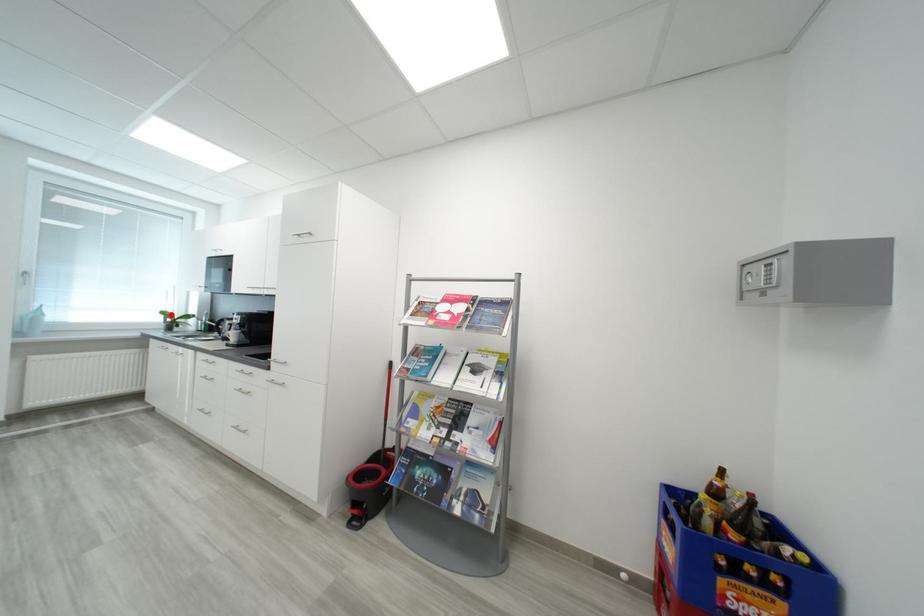
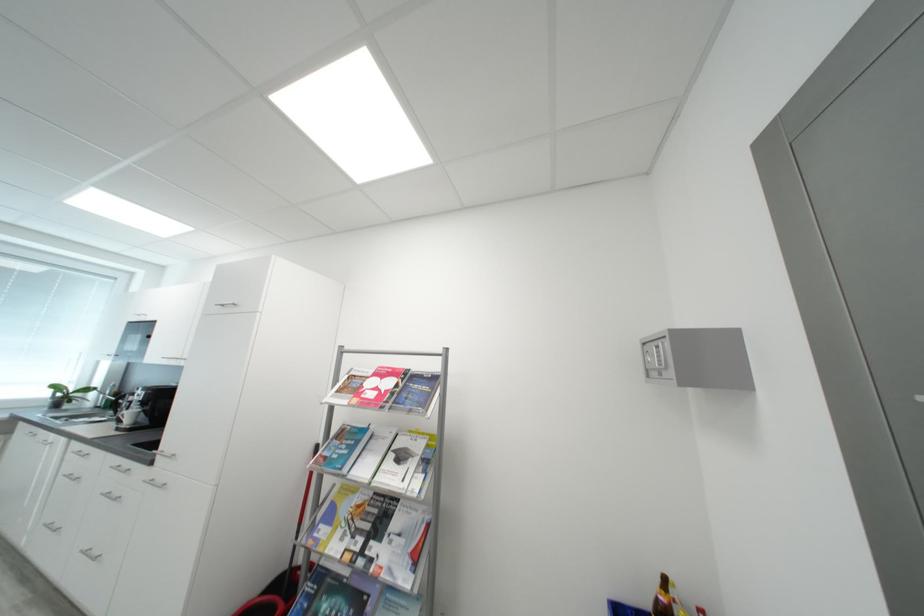
Question: I am providing you with two images of the same scene from different viewpoints. Image1 has a red point marked. In image2, the corresponding 3D location appears at what relative position? Reply with the corresponding letter.

Choices:
 (A) Closer
 (B) Farther

Answer: (A)